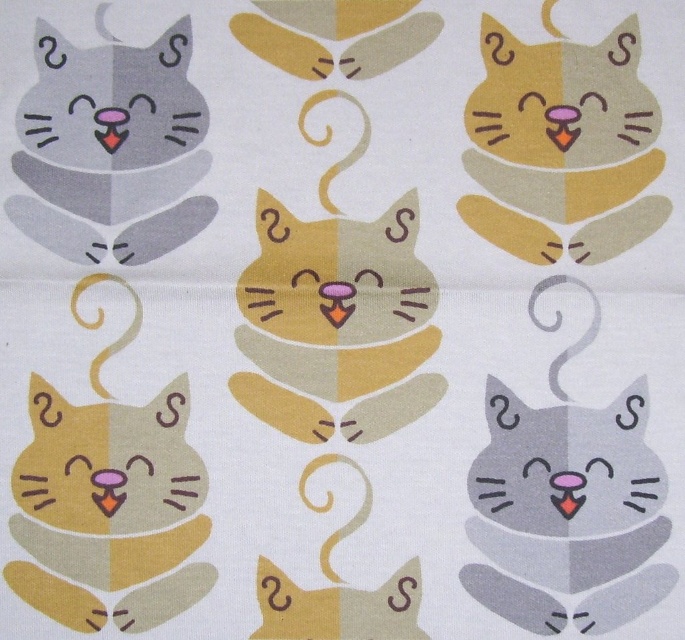
Question: Among these points, which one is farthest from the camera?

Choices:
 (A) (656, 134)
 (B) (77, 248)
 (C) (45, 534)

Answer: (A)

Question: Can you confirm if matte gray cat at lower right is wider than matte yellow cat at lower left?

Choices:
 (A) yes
 (B) no

Answer: (A)

Question: Which point is farther to the camera?

Choices:
 (A) (603, 429)
 (B) (153, 564)
 (C) (123, 200)
 (D) (314, 342)

Answer: (D)

Question: Which point is farther to the camera?

Choices:
 (A) matte yellow cat at center
 (B) matte orange cat at upper right
 (C) matte gray cat at lower right
 (D) matte gray cat at upper left

Answer: (B)

Question: Does matte yellow cat at center have a larger size compared to matte gray cat at upper left?

Choices:
 (A) no
 (B) yes

Answer: (B)

Question: Is matte yellow cat at center wider than matte gray cat at upper left?

Choices:
 (A) no
 (B) yes

Answer: (B)